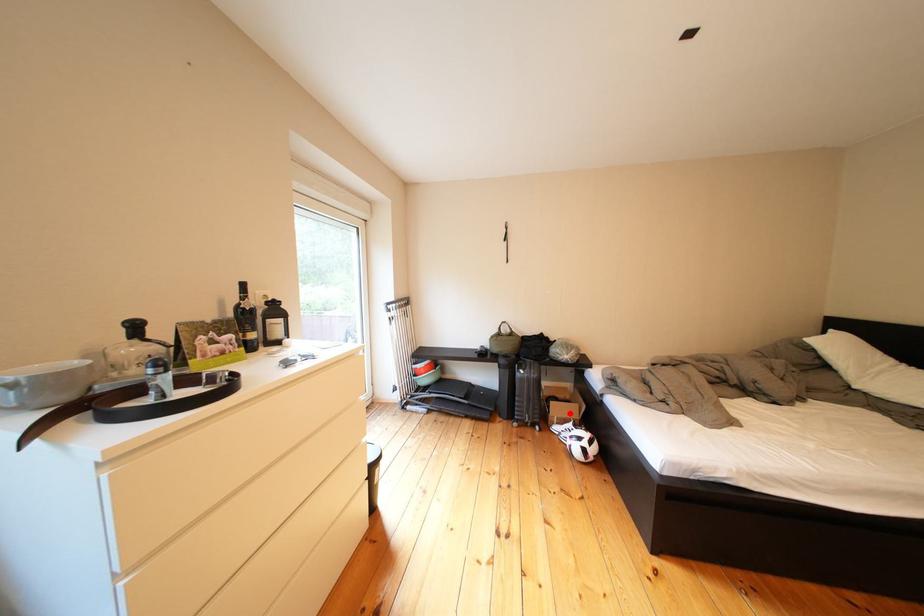
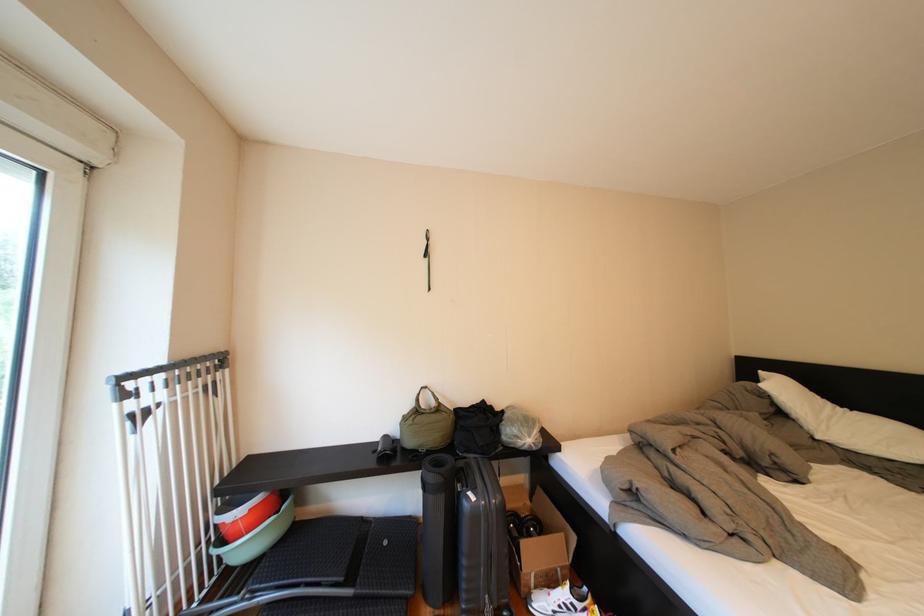
The point at the highlighted location is marked in the first image. Where is the corresponding point in the second image?

(544, 557)